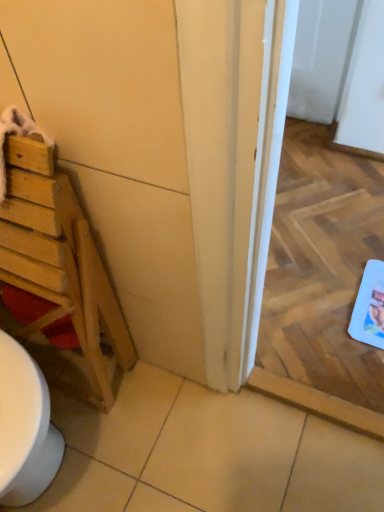
Question: Relative to white glossy screen door at center, is wooden ladder at left in front or behind?

Choices:
 (A) front
 (B) behind

Answer: (A)

Question: Choose the correct answer: Is wooden ladder at left inside white glossy screen door at center or outside it?

Choices:
 (A) outside
 (B) inside

Answer: (A)

Question: Which object is positioned closest to the wooden door at left?

Choices:
 (A) white glossy screen door at center
 (B) wooden ladder at left

Answer: (B)

Question: Considering the real-world distances, which object is farthest from the wooden door at left?

Choices:
 (A) wooden ladder at left
 (B) white glossy screen door at center

Answer: (B)